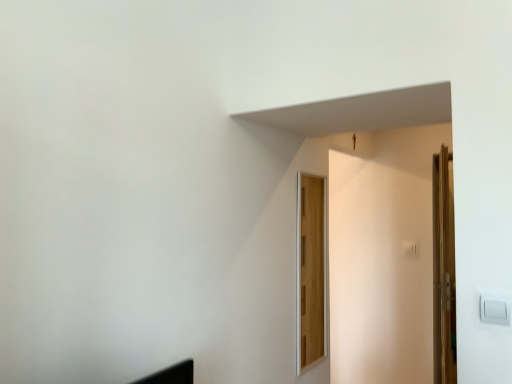
Question: Considering the positions of wooden door at right, which ranks as the 2th door in left-to-right order, and wooden door at center, which is the first door in front-to-back order, in the image, is wooden door at right, which ranks as the 2th door in left-to-right order, wider or thinner than wooden door at center, which is the first door in front-to-back order,?

Choices:
 (A) wide
 (B) thin

Answer: (A)

Question: Is point (444, 281) positioned closer to the camera than point (316, 354)?

Choices:
 (A) farther
 (B) closer

Answer: (B)

Question: Choose the correct answer: Is wooden door at right, which is the second door from front to back, inside wooden door at center, acting as the first door starting from the left, or outside it?

Choices:
 (A) outside
 (B) inside

Answer: (A)

Question: From a real-world perspective, is wooden door at center, which is the first door in front-to-back order, physically located above or below wooden door at right, which ranks as the 2th door in left-to-right order?

Choices:
 (A) above
 (B) below

Answer: (A)

Question: Considering the positions of point (306, 241) and point (437, 210), is point (306, 241) closer or farther from the camera than point (437, 210)?

Choices:
 (A) closer
 (B) farther

Answer: (B)

Question: Looking at the image, does wooden door at center, which is the first door in front-to-back order, seem bigger or smaller compared to wooden door at right, which is the second door from front to back?

Choices:
 (A) small
 (B) big

Answer: (A)

Question: In terms of height, does wooden door at center, acting as the first door starting from the left, look taller or shorter compared to wooden door at right, which is the second door from front to back?

Choices:
 (A) short
 (B) tall

Answer: (A)